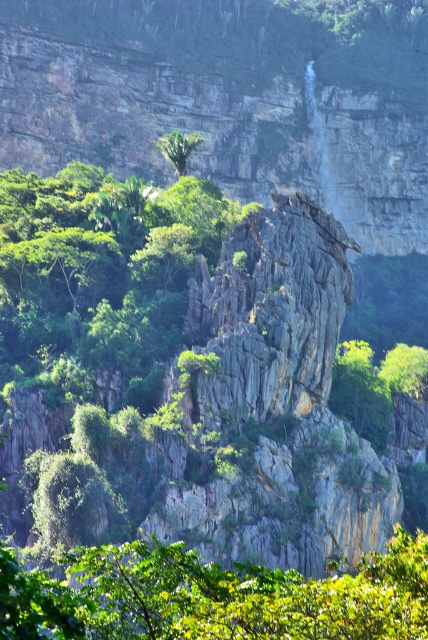
You are standing at the base of the central rock formation and want to walk towards the green leafy tree at center. Which direction should you move relative to the green leafy tree at upper center?

The green leafy tree at center is to the right of the green leafy tree at upper center. So, to reach the green leafy tree at center, you should move towards the right side relative to the green leafy tree at upper center.

You are a hiker trying to navigate through the rocky terrain. You see two green leafy trees in the scene. Which tree, the green leafy tree at center or the green leafy tree at upper center, would you choose to rest under if you want to have more shade?

The green leafy tree at center is bigger than the green leafy tree at upper center, so it would provide more shade. You should choose the green leafy tree at center to rest under.